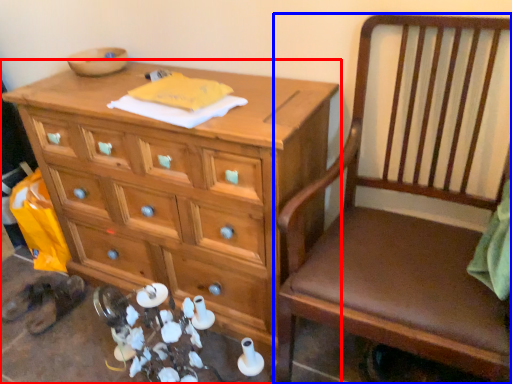
Question: Which point is closer to the camera, chest of drawers (highlighted by a red box) or chair (highlighted by a blue box)?

Choices:
 (A) chest of drawers
 (B) chair

Answer: (B)